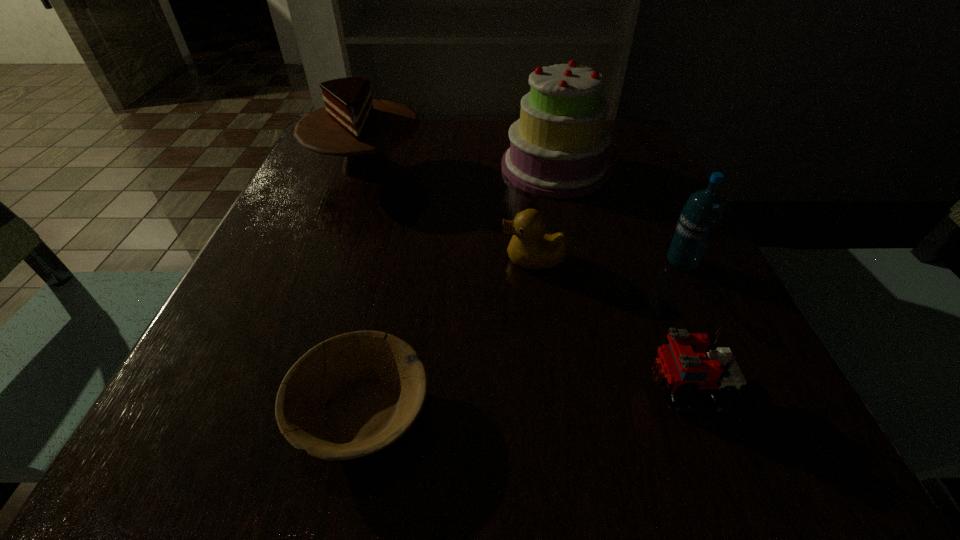
Where is `the right cake`? This screenshot has width=960, height=540. the right cake is located at coordinates (558, 148).

Find the location of a particular element. This screenshot has height=540, width=960. the taller cake is located at coordinates (558, 148).

I want to click on water bottle, so click(699, 219).

Where is `the shorter cake`? the shorter cake is located at coordinates (351, 124).

At what (x,y) coordinates should I click in order to perform the action: click on duckling. Please return your answer as a coordinate pair (x, y). This screenshot has width=960, height=540. Looking at the image, I should click on (530, 247).

What are the coordinates of `Lego` in the screenshot? It's located at (690, 362).

At what (x,y) coordinates should I click in order to perform the action: click on the shortest object. Please return your answer as a coordinate pair (x, y). Looking at the image, I should click on (373, 385).

This screenshot has width=960, height=540. Identify the location of free space located on the right of the right cake. (655, 167).

Where is `free space located 0.100m on the front of the water bottle`? The width and height of the screenshot is (960, 540). free space located 0.100m on the front of the water bottle is located at coordinates tap(709, 321).

Identify the location of vacant space located on the right of the left cake. (564, 166).